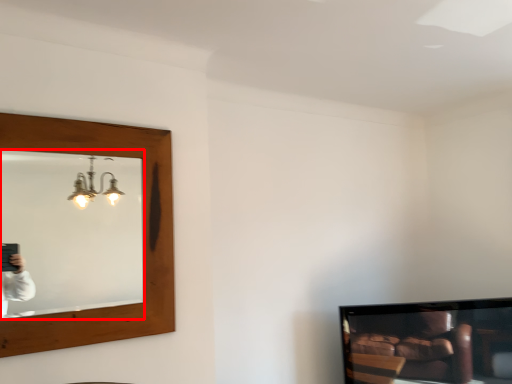
Question: From the image's perspective, what is the correct spatial positioning of mirror (annotated by the red box) in reference to television?

Choices:
 (A) below
 (B) above

Answer: (B)